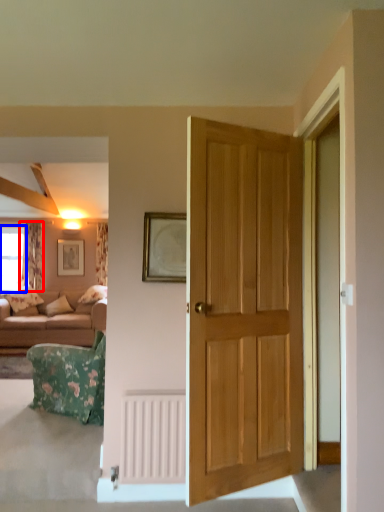
Question: Which point is further to the camera, curtain (highlighted by a red box) or window (highlighted by a blue box)?

Choices:
 (A) curtain
 (B) window

Answer: (B)